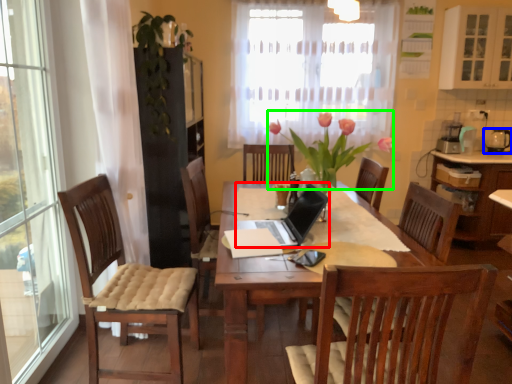
Question: Estimate the real-world distances between objects in this image. Which object is closer to laptop (highlighted by a red box), tableware (highlighted by a blue box) or floral arrangement (highlighted by a green box)?

Choices:
 (A) tableware
 (B) floral arrangement

Answer: (B)